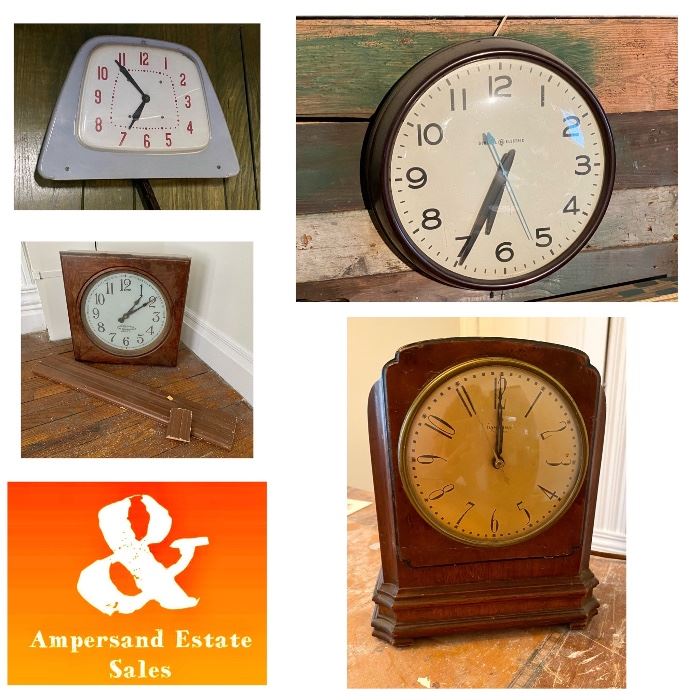
Where is `door`? door is located at coordinates (573, 328).